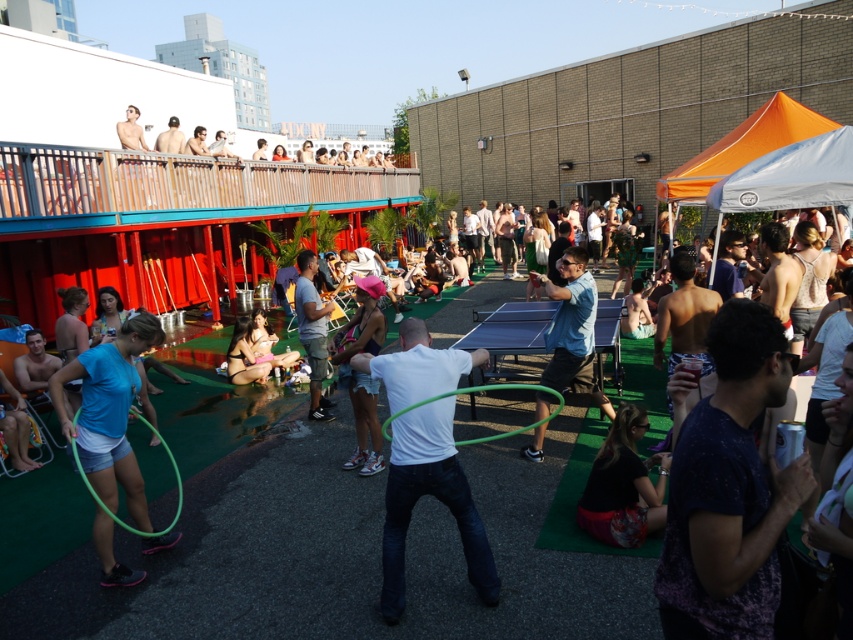
Does purple speckled shirt at center-right have a larger size compared to white matte shirt at center?

No, purple speckled shirt at center-right is not bigger than white matte shirt at center.

How much distance is there between purple speckled shirt at center-right and white matte shirt at center?

purple speckled shirt at center-right is 5.72 feet away from white matte shirt at center.

Who is more distant from viewer, (723,362) or (381,563)?

Positioned behind is point (381,563).

Find the location of a particular element. The image size is (853, 640). purple speckled shirt at center-right is located at coordinates (729, 490).

Does purple speckled shirt at center-right appear under green rubber hula hoop at center?

Incorrect, purple speckled shirt at center-right is not positioned below green rubber hula hoop at center.

Is point (751, 410) less distant than point (558, 406)?

Yes, point (751, 410) is closer to viewer.

Image resolution: width=853 pixels, height=640 pixels. I want to click on purple speckled shirt at center-right, so click(x=729, y=490).

In the scene shown: Can you confirm if white matte shirt at center is wider than blue fabric hula hoop at center-left?

Indeed, white matte shirt at center has a greater width compared to blue fabric hula hoop at center-left.

Is white matte shirt at center above blue fabric hula hoop at center-left?

Actually, white matte shirt at center is below blue fabric hula hoop at center-left.

Measure the distance between point [407,323] and camera.

Point [407,323] is 11.99 feet away from camera.

This screenshot has height=640, width=853. Find the location of `white matte shirt at center`. white matte shirt at center is located at coordinates (434, 497).